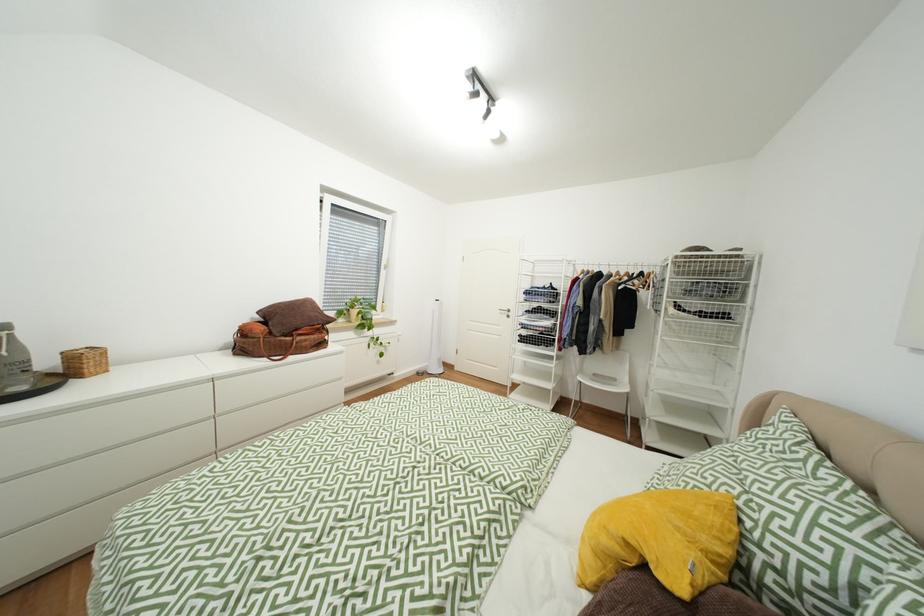
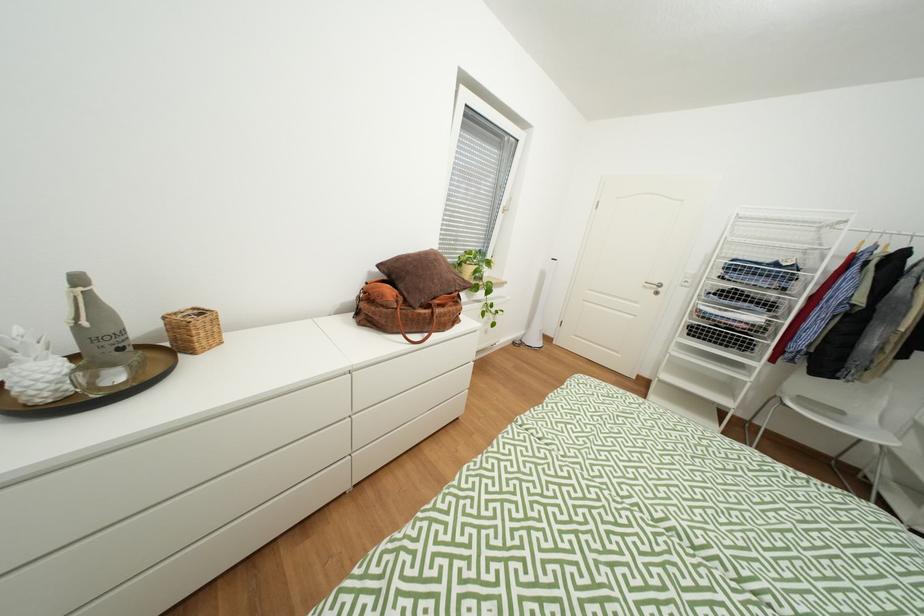
Which direction would the cameraman need to move to produce the second image?

The cameraman walked toward left, forward.